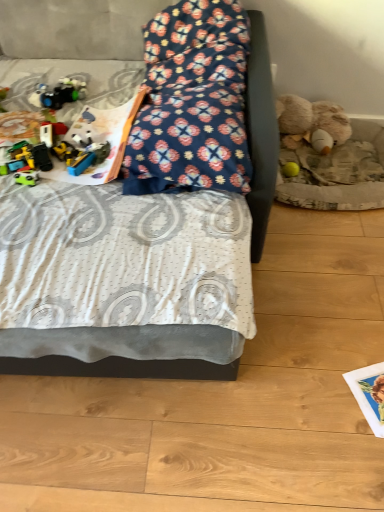
Question: Considering the relative positions of floral fabric bed at center and shiny plastic toy car at left, the 2th toy in the front-to-back sequence, in the image provided, is floral fabric bed at center to the left of shiny plastic toy car at left, the 2th toy in the front-to-back sequence, from the viewer's perspective?

Choices:
 (A) yes
 (B) no

Answer: (B)

Question: Is floral fabric bed at center directly adjacent to shiny plastic toy car at left, arranged as the 1th toy when viewed from the top?

Choices:
 (A) yes
 (B) no

Answer: (B)

Question: Considering the relative sizes of floral fabric bed at center and shiny plastic toy car at left, marked as the 3th toy in a bottom-to-top arrangement, in the image provided, is floral fabric bed at center wider than shiny plastic toy car at left, marked as the 3th toy in a bottom-to-top arrangement,?

Choices:
 (A) no
 (B) yes

Answer: (B)

Question: Is floral fabric bed at center shorter than shiny plastic toy car at left, arranged as the 1th toy when viewed from the top?

Choices:
 (A) yes
 (B) no

Answer: (B)

Question: Could you tell me if floral fabric bed at center is facing shiny plastic toy car at left, the 2th toy in the front-to-back sequence?

Choices:
 (A) yes
 (B) no

Answer: (A)

Question: In the image, is floral fabric pillow at center positioned in front of or behind matte green toy car at left, placed as the first toy when sorted from front to back?

Choices:
 (A) front
 (B) behind

Answer: (A)

Question: Is floral fabric pillow at center situated inside matte green toy car at left, which is the second toy from left to right, or outside?

Choices:
 (A) inside
 (B) outside

Answer: (B)

Question: Considering the positions of floral fabric pillow at center and matte green toy car at left, the 2th toy when ordered from right to left, in the image, is floral fabric pillow at center wider or thinner than matte green toy car at left, the 2th toy when ordered from right to left,?

Choices:
 (A) thin
 (B) wide

Answer: (B)

Question: Visually, is floral fabric pillow at center positioned to the left or to the right of matte green toy car at left, positioned as the first toy in bottom-to-top order?

Choices:
 (A) right
 (B) left

Answer: (A)

Question: In terms of size, does yellow rubber ball at lower right, the third toy from the left, appear bigger or smaller than matte green toy car at left, positioned as the first toy in bottom-to-top order?

Choices:
 (A) big
 (B) small

Answer: (A)

Question: Looking at their shapes, would you say yellow rubber ball at lower right, the third toy from the left, is wider or thinner than matte green toy car at left, which ranks as the third toy in top-to-bottom order?

Choices:
 (A) thin
 (B) wide

Answer: (A)

Question: Does point (286, 162) appear closer or farther from the camera than point (24, 179)?

Choices:
 (A) closer
 (B) farther

Answer: (B)

Question: Would you say yellow rubber ball at lower right, the first toy viewed from the right, is to the left or to the right of matte green toy car at left, which is the second toy from left to right, in the picture?

Choices:
 (A) left
 (B) right

Answer: (B)

Question: Is point (288, 165) positioned closer to the camera than point (200, 374)?

Choices:
 (A) closer
 (B) farther

Answer: (B)

Question: From the image's perspective, relative to floral fabric bed at center, is yellow rubber ball at lower right, the third toy from the front, above or below?

Choices:
 (A) below
 (B) above

Answer: (A)